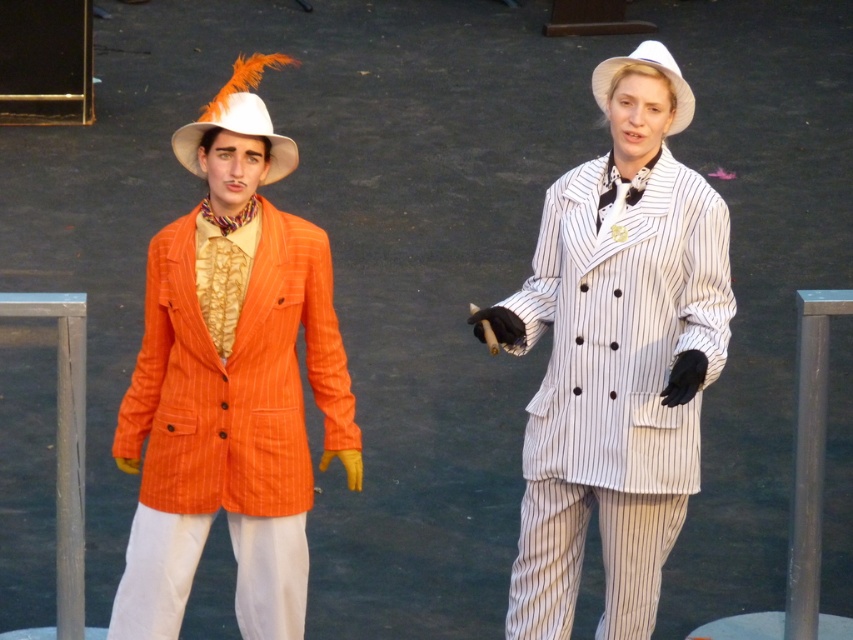
Is point (248, 64) closer to camera compared to point (675, 100)?

That is True.

What do you see at coordinates (239, 118) in the screenshot? I see `matte white cowboy hat at left` at bounding box center [239, 118].

The height and width of the screenshot is (640, 853). What do you see at coordinates (239, 118) in the screenshot?
I see `matte white cowboy hat at left` at bounding box center [239, 118].

Locate an element on the screen. matte white cowboy hat at left is located at coordinates (239, 118).

Between orange pinstripe suit at left and matte white cowboy hat at left, which one has less height?

With less height is matte white cowboy hat at left.

Which is more to the left, orange pinstripe suit at left or matte white cowboy hat at left?

Positioned to the left is orange pinstripe suit at left.

Who is more distant from viewer, (140, 444) or (273, 180)?

Point (273, 180)

Locate an element on the screen. This screenshot has height=640, width=853. orange pinstripe suit at left is located at coordinates (230, 381).

Which is behind, point (548, 529) or point (680, 125)?

Point (548, 529)

Between point (614, 465) and point (693, 106), which one is positioned behind?

The point (693, 106) is more distant.

Identify the location of white pinstriped suit at center. (616, 355).